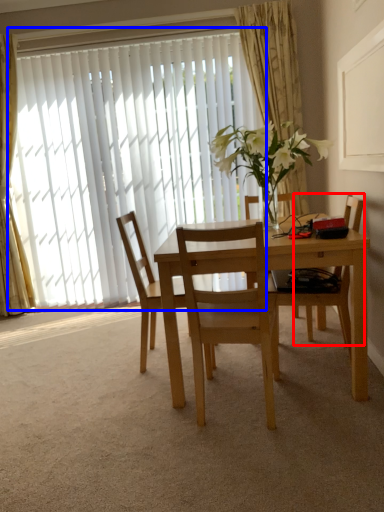
Question: Which object appears farthest to the camera in this image, chair (highlighted by a red box) or window (highlighted by a blue box)?

Choices:
 (A) chair
 (B) window

Answer: (B)